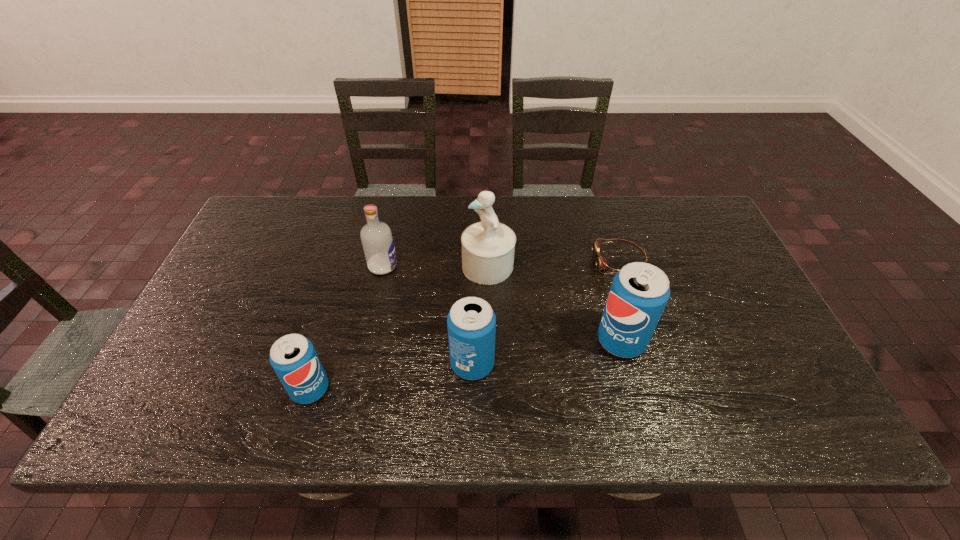
Given the evenly spaced soda cans in the image, where should an extra soda can be added on the right to preserve the spacing? Please point to a vacant space. Please provide its 2D coordinates. Your answer should be formatted as a tuple, i.e. [(x, y)], where the tuple contains the x and y coordinates of a point satisfying the conditions above.

[(757, 320)]